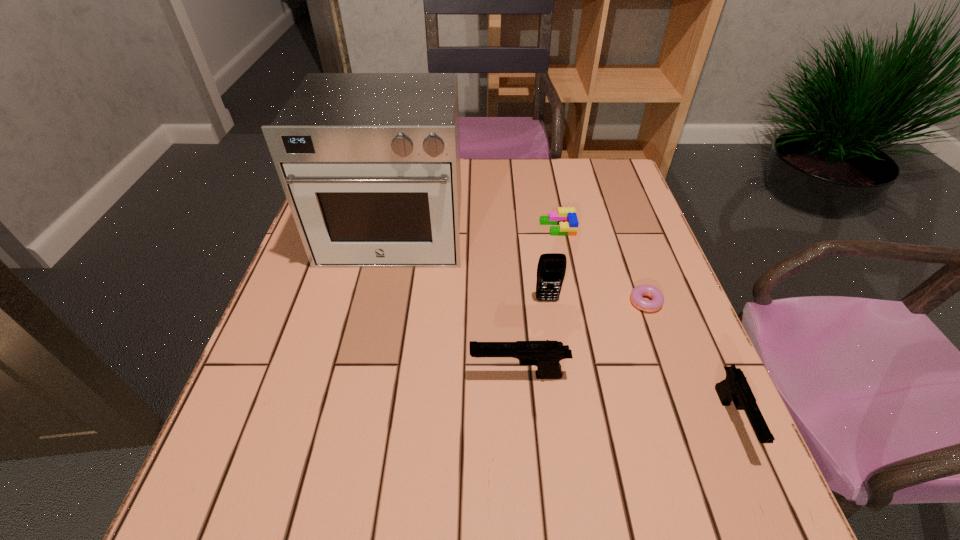
I want to click on pistol that is at the right edge, so click(734, 387).

In order to click on doughnut that is at the right edge in this screenshot , I will do `click(654, 293)`.

In order to click on object at the far left corner in this screenshot , I will do `click(369, 162)`.

Identify the location of object that is at the near right corner. (734, 387).

The height and width of the screenshot is (540, 960). Identify the location of vacant space at the far edge of the desktop. (519, 164).

The height and width of the screenshot is (540, 960). In the image, there is a desktop. What are the coordinates of `free space at the near edge` in the screenshot? It's located at (367, 449).

The height and width of the screenshot is (540, 960). Find the location of `free space at the left edge of the desktop`. free space at the left edge of the desktop is located at coordinates (335, 296).

Where is `vacant area at the right edge`? vacant area at the right edge is located at coordinates (596, 247).

Where is `vacant space at the near left corner of the desktop`? vacant space at the near left corner of the desktop is located at coordinates (227, 424).

This screenshot has height=540, width=960. I want to click on free space at the near right corner of the desktop, so click(x=681, y=450).